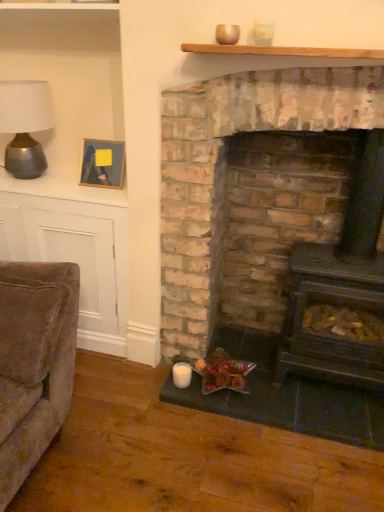
You are a GUI agent. You are given a task and a screenshot of the screen. Output one action in this format:
    pyautogui.click(x=<x>, y=<y>)
    Task: Click on the vacant space behind shiny brown nuts at lower center
    The width and height of the screenshot is (384, 512).
    Given the screenshot: What is the action you would take?
    pyautogui.click(x=238, y=349)